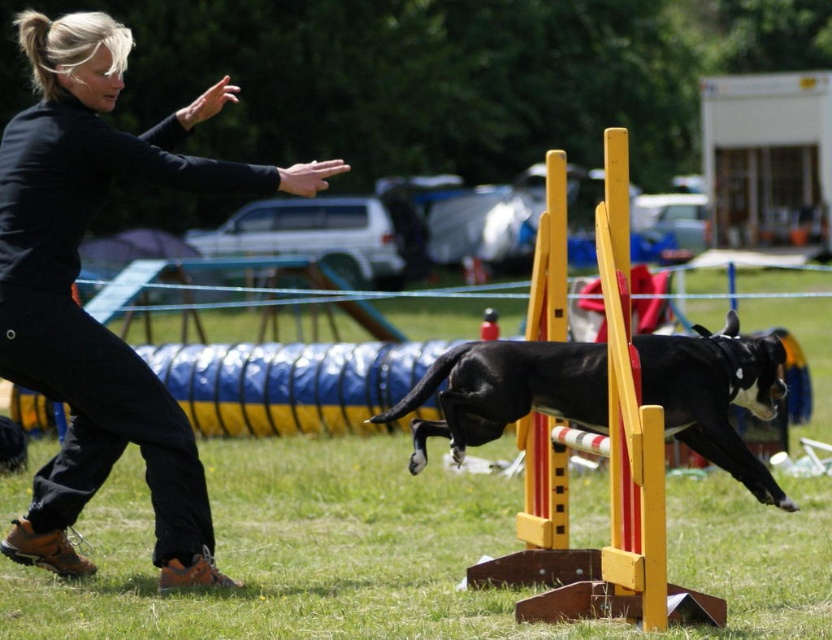
Is black matte pants at lower left taller than black glossy dog at center?

Indeed, black matte pants at lower left has a greater height compared to black glossy dog at center.

Does black matte pants at lower left appear on the right side of black glossy dog at center?

In fact, black matte pants at lower left is to the left of black glossy dog at center.

Is point (13, 324) farther from viewer compared to point (684, 436)?

No, it is in front of (684, 436).

Find the location of a particular element. The height and width of the screenshot is (640, 832). black matte pants at lower left is located at coordinates [83, 308].

Is point (137, 385) farther from viewer compared to point (615, 374)?

Yes, point (137, 385) is behind point (615, 374).

Is black matte pants at lower left to the left of yellow wooden hurdle at center from the viewer's perspective?

Indeed, black matte pants at lower left is positioned on the left side of yellow wooden hurdle at center.

Where is `black matte pants at lower left`? The height and width of the screenshot is (640, 832). black matte pants at lower left is located at coordinates (83, 308).

Locate an element on the screen. The image size is (832, 640). black matte pants at lower left is located at coordinates (83, 308).

Which of these two, yellow wooden hurdle at center or black glossy dog at center, stands shorter?

Standing shorter between the two is black glossy dog at center.

The image size is (832, 640). Find the location of `yellow wooden hurdle at center`. yellow wooden hurdle at center is located at coordinates tap(608, 472).

Where is `yellow wooden hurdle at center`? The height and width of the screenshot is (640, 832). yellow wooden hurdle at center is located at coordinates (608, 472).

You are a GUI agent. You are given a task and a screenshot of the screen. Output one action in this format:
    pyautogui.click(x=<x>, y=<y>)
    Task: Click on the yellow wooden hurdle at center
    This screenshot has height=640, width=832.
    Given the screenshot: What is the action you would take?
    pyautogui.click(x=608, y=472)